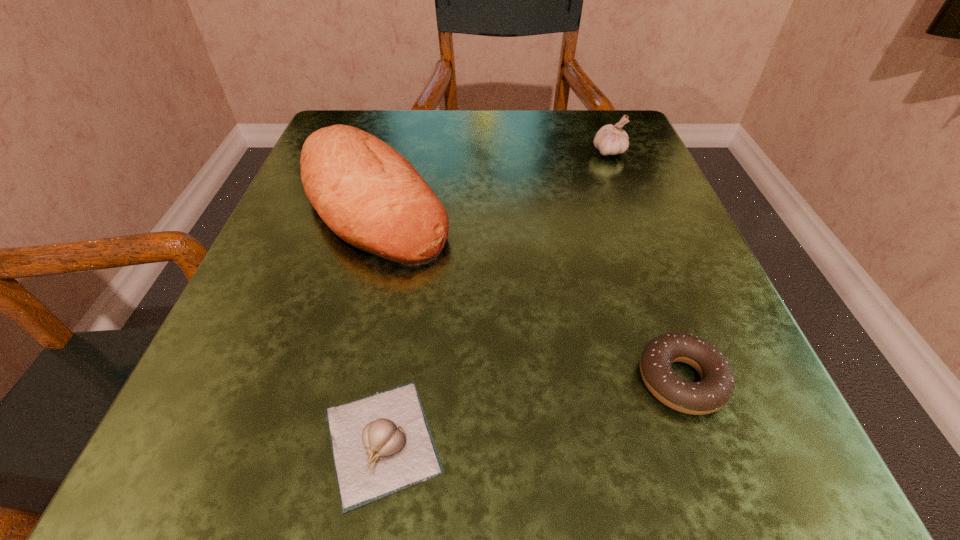
Identify the location of vacant area between the doughnut and the nearer garlic. (532, 410).

What are the coordinates of `blank region between the third tallest object and the shortest object` in the screenshot? It's located at (532, 410).

Image resolution: width=960 pixels, height=540 pixels. Find the location of `vacant space in between the farther garlic and the third tallest object`. vacant space in between the farther garlic and the third tallest object is located at coordinates (645, 266).

At what (x,y) coordinates should I click in order to perform the action: click on empty space between the left garlic and the third tallest object. Please return your answer as a coordinate pair (x, y). This screenshot has height=540, width=960. Looking at the image, I should click on (532, 410).

Locate an element on the screen. The height and width of the screenshot is (540, 960). vacant space that's between the doughnut and the taller garlic is located at coordinates (645, 266).

Identify the location of vacant space that is in between the shortest object and the doughnut. Image resolution: width=960 pixels, height=540 pixels. (532, 410).

Locate an element on the screen. The height and width of the screenshot is (540, 960). vacant area between the doughnut and the right garlic is located at coordinates (645, 266).

The width and height of the screenshot is (960, 540). What are the coordinates of `free space between the nearer garlic and the bread` in the screenshot? It's located at (x=377, y=322).

At what (x,y) coordinates should I click in order to perform the action: click on the closest object to the nearer garlic. Please return your answer as a coordinate pair (x, y). Looking at the image, I should click on (368, 194).

Select which object appears as the closest to the tallest object. Please provide its 2D coordinates. Your answer should be formatted as a tuple, i.e. [(x, y)], where the tuple contains the x and y coordinates of a point satisfying the conditions above.

[(381, 444)]